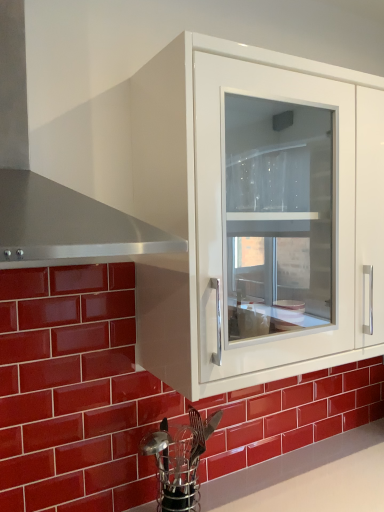
Question: Is metallic silver utensil holder at lower center far from glossy ceramic brick at lower left?

Choices:
 (A) no
 (B) yes

Answer: (A)

Question: From a real-world perspective, is metallic silver utensil holder at lower center positioned under glossy ceramic brick at lower left based on gravity?

Choices:
 (A) yes
 (B) no

Answer: (A)

Question: Is metallic silver utensil holder at lower center completely or partially outside of glossy ceramic brick at lower left?

Choices:
 (A) yes
 (B) no

Answer: (A)

Question: From the image's perspective, is metallic silver utensil holder at lower center located beneath glossy ceramic brick at lower left?

Choices:
 (A) no
 (B) yes

Answer: (B)

Question: Can you confirm if metallic silver utensil holder at lower center is taller than glossy ceramic brick at lower left?

Choices:
 (A) yes
 (B) no

Answer: (B)

Question: Could you tell me if metallic silver utensil holder at lower center is facing glossy ceramic brick at lower left?

Choices:
 (A) no
 (B) yes

Answer: (A)

Question: Is metallic silver utensil holder at lower center at the back of stainless steel exhaust hood at left?

Choices:
 (A) yes
 (B) no

Answer: (B)

Question: From the image's perspective, is stainless steel exhaust hood at left below metallic silver utensil holder at lower center?

Choices:
 (A) no
 (B) yes

Answer: (A)

Question: Would you consider stainless steel exhaust hood at left to be distant from metallic silver utensil holder at lower center?

Choices:
 (A) no
 (B) yes

Answer: (A)

Question: Considering the relative positions of stainless steel exhaust hood at left and metallic silver utensil holder at lower center in the image provided, is stainless steel exhaust hood at left to the right of metallic silver utensil holder at lower center from the viewer's perspective?

Choices:
 (A) yes
 (B) no

Answer: (B)

Question: Can you confirm if stainless steel exhaust hood at left is thinner than metallic silver utensil holder at lower center?

Choices:
 (A) yes
 (B) no

Answer: (B)

Question: From a real-world perspective, is stainless steel exhaust hood at left under metallic silver utensil holder at lower center?

Choices:
 (A) yes
 (B) no

Answer: (B)

Question: Does glossy ceramic brick at lower left turn towards white glossy cabinet at upper center?

Choices:
 (A) yes
 (B) no

Answer: (B)